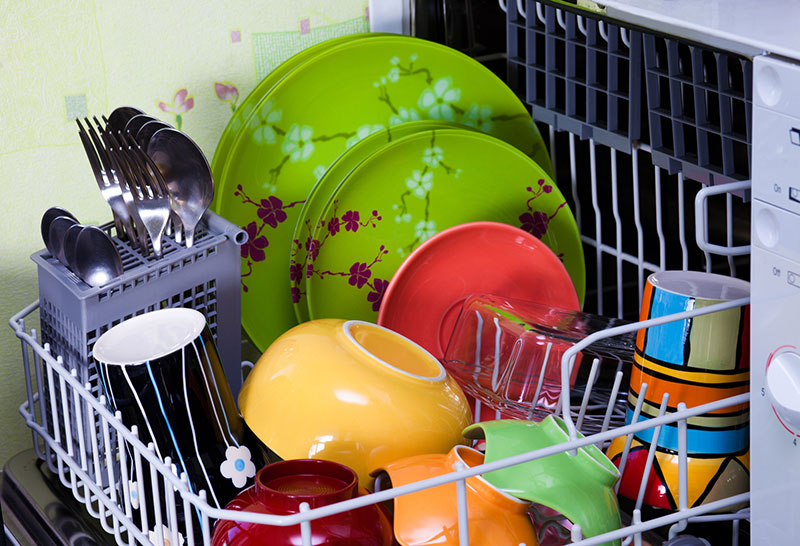
This screenshot has height=546, width=800. I want to click on plastic coasted dividers on right side of bottom rack of dishwasher, so click(736, 525), click(633, 525), click(570, 534), click(684, 460), click(520, 542), click(464, 521), click(308, 531).